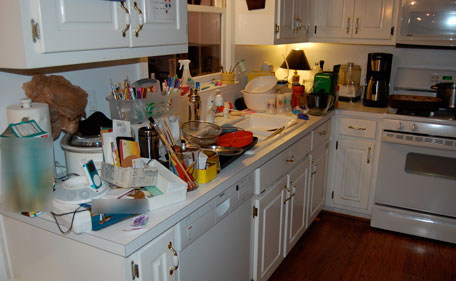
Locate an element on the screen. sink is located at coordinates (261, 126).